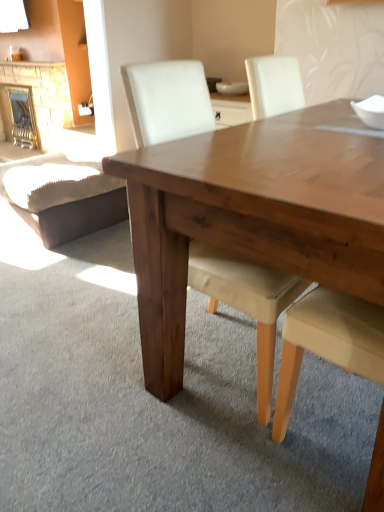
Question: Is white glossy bowl at upper right, acting as the second bowl starting from the back, outside of brick fireplace at left, the 1th fireplace from the right?

Choices:
 (A) no
 (B) yes

Answer: (B)

Question: From a real-world perspective, is white glossy bowl at upper right, which is counted as the first bowl, starting from the right, on top of brick fireplace at left, which appears as the 2th fireplace when viewed from the left?

Choices:
 (A) yes
 (B) no

Answer: (A)

Question: Could you tell me if white glossy bowl at upper right, the first bowl in the bottom-to-top sequence, is turned towards brick fireplace at left, which appears as the 2th fireplace when viewed from the left?

Choices:
 (A) yes
 (B) no

Answer: (B)

Question: Considering the relative sizes of white glossy bowl at upper right, the first bowl in the bottom-to-top sequence, and brick fireplace at left, which appears as the 2th fireplace when viewed from the left, in the image provided, is white glossy bowl at upper right, the first bowl in the bottom-to-top sequence, shorter than brick fireplace at left, which appears as the 2th fireplace when viewed from the left,?

Choices:
 (A) yes
 (B) no

Answer: (A)

Question: From a real-world perspective, is white glossy bowl at upper right, acting as the second bowl starting from the back, under brick fireplace at left, the 1th fireplace from the right?

Choices:
 (A) yes
 (B) no

Answer: (B)

Question: From a real-world perspective, relative to white glossy bowl at center, the second bowl ordered from the bottom, is brick fireplace at left, which appears as the 2th fireplace when viewed from the left, vertically above or below?

Choices:
 (A) above
 (B) below

Answer: (B)

Question: From the image's perspective, is brick fireplace at left, the 1th fireplace from the right, above or below white glossy bowl at center, marked as the 1th bowl in a left-to-right arrangement?

Choices:
 (A) above
 (B) below

Answer: (A)

Question: Does point (11, 102) appear closer or farther from the camera than point (218, 91)?

Choices:
 (A) closer
 (B) farther

Answer: (B)

Question: In terms of width, does brick fireplace at left, the 1th fireplace from the right, look wider or thinner when compared to white glossy bowl at center, which is the 1th bowl in top-to-bottom order?

Choices:
 (A) wide
 (B) thin

Answer: (A)

Question: Is brown leather swivel chair at lower left wider or thinner than matte white chair at center?

Choices:
 (A) wide
 (B) thin

Answer: (A)

Question: Which is correct: brown leather swivel chair at lower left is inside matte white chair at center, or outside of it?

Choices:
 (A) inside
 (B) outside

Answer: (B)

Question: Considering their positions, is brown leather swivel chair at lower left located in front of or behind matte white chair at center?

Choices:
 (A) behind
 (B) front

Answer: (A)

Question: From their relative heights in the image, would you say brown leather swivel chair at lower left is taller or shorter than matte white chair at center?

Choices:
 (A) short
 (B) tall

Answer: (A)

Question: From a real-world perspective, is brick fireplace at left, the 1th fireplace from the right, above or below white glossy bowl at upper right, the first bowl in the bottom-to-top sequence?

Choices:
 (A) below
 (B) above

Answer: (A)

Question: Is point click(9, 93) positioned closer to the camera than point click(380, 96)?

Choices:
 (A) farther
 (B) closer

Answer: (A)